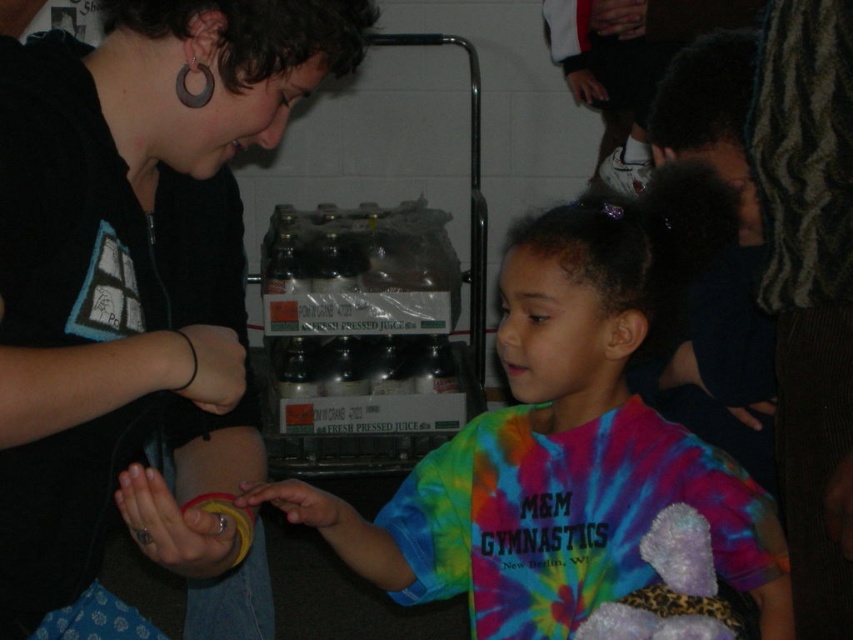
Is tie-dye fabric shirt at center smaller than smooth yellow ring at center?

No.

Who is more forward, (683,461) or (335,531)?

Point (683,461)

What do you see at coordinates (573, 442) in the screenshot?
I see `tie-dye fabric shirt at center` at bounding box center [573, 442].

Image resolution: width=853 pixels, height=640 pixels. I want to click on tie-dye fabric shirt at center, so click(x=573, y=442).

Is black matte shirt at center below matte gold ring at lower left?

Actually, black matte shirt at center is above matte gold ring at lower left.

Which of these two, black matte shirt at center or matte gold ring at lower left, stands shorter?

Standing shorter between the two is matte gold ring at lower left.

Is point (167, 419) positioned in front of point (195, 486)?

That is False.

At what (x,y) coordinates should I click in order to perform the action: click on black matte shirt at center. Please return your answer as a coordinate pair (x, y). The width and height of the screenshot is (853, 640). Looking at the image, I should click on (135, 294).

Which is in front, point (128, 164) or point (239, 372)?

Point (128, 164)

Does point (138, 371) come in front of point (223, 342)?

Yes.

Find the location of a particular element. black matte shirt at center is located at coordinates (135, 294).